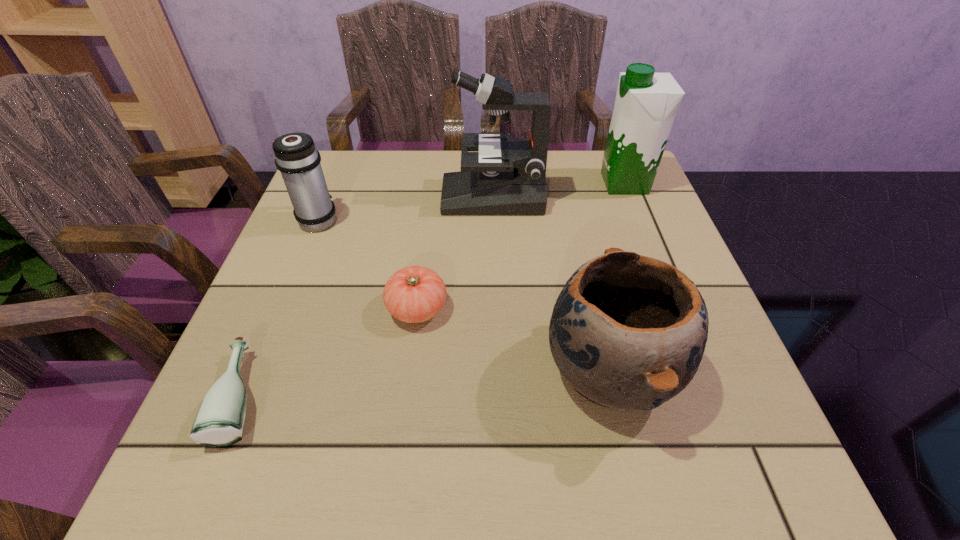
At what (x,y) coordinates should I click in order to perform the action: click on microscope. Please return your answer as a coordinate pair (x, y). The image size is (960, 540). Looking at the image, I should click on (507, 176).

At what (x,y) coordinates should I click in order to perform the action: click on soya milk. Please return your answer as a coordinate pair (x, y). This screenshot has height=540, width=960. Looking at the image, I should click on (646, 103).

I want to click on thermos bottle, so [x=296, y=157].

What are the coordinates of `pottery` in the screenshot? It's located at (627, 331).

Where is `the fifth tallest object`? The width and height of the screenshot is (960, 540). the fifth tallest object is located at coordinates (415, 294).

The width and height of the screenshot is (960, 540). What are the coordinates of `the shortest object` in the screenshot? It's located at (220, 421).

Find the location of `vacant region located through the eyepieces of the microscope`. vacant region located through the eyepieces of the microscope is located at coordinates (335, 196).

Where is `vacant space located 0.180m through the eyepieces of the microscope`? Image resolution: width=960 pixels, height=540 pixels. vacant space located 0.180m through the eyepieces of the microscope is located at coordinates (371, 196).

Locate an element on the screen. The width and height of the screenshot is (960, 540). vacant space located 0.310m through the eyepieces of the microscope is located at coordinates (319, 196).

Identify the location of vacant space located 0.210m on the front-facing side of the soya milk. The width and height of the screenshot is (960, 540). (518, 184).